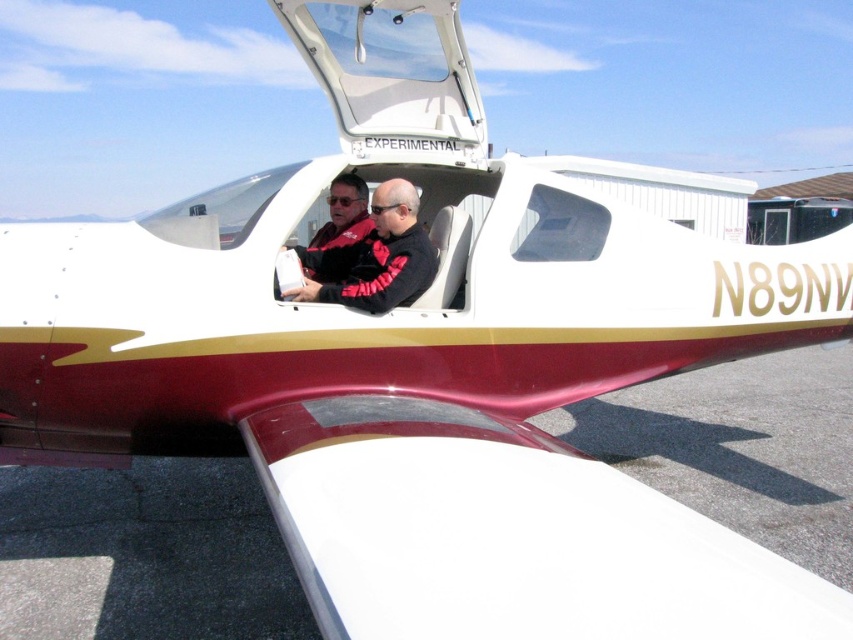
You are a passenger in the cockpit of the aircraft and need to locate your jacket. The black leather jacket at center and the red and black jacket at center are both present. Which jacket is closer to the floor?

The black leather jacket at center is positioned under the red and black jacket at center, so it is closer to the floor.

You are a pilot preparing to enter the cockpit and notice two jackets at the center. Which jacket is taller, the black leather jacket at center or the red and black jacket at center?

The black leather jacket at center is taller than the red and black jacket at center according to the description.